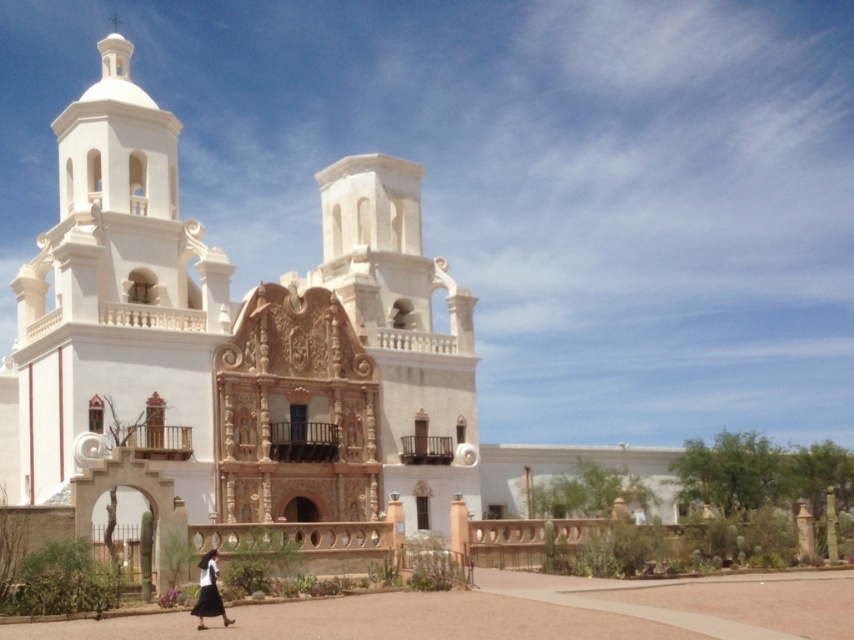
Between white stucco church at center and white cotton dress at lower center, which one has more height?

Standing taller between the two is white stucco church at center.

The width and height of the screenshot is (854, 640). Describe the element at coordinates (234, 348) in the screenshot. I see `white stucco church at center` at that location.

Is point (173, 332) farther from camera compared to point (203, 579)?

Yes.

Image resolution: width=854 pixels, height=640 pixels. I want to click on white stucco church at center, so click(x=234, y=348).